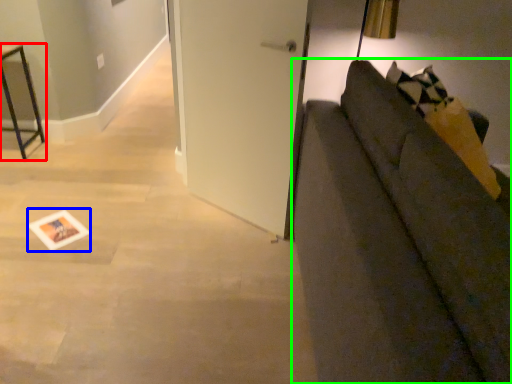
Question: Based on their relative distances, which object is farther from furniture (highlighted by a red box)? Choose from postcard (highlighted by a blue box) and studio couch (highlighted by a green box).

Choices:
 (A) postcard
 (B) studio couch

Answer: (B)